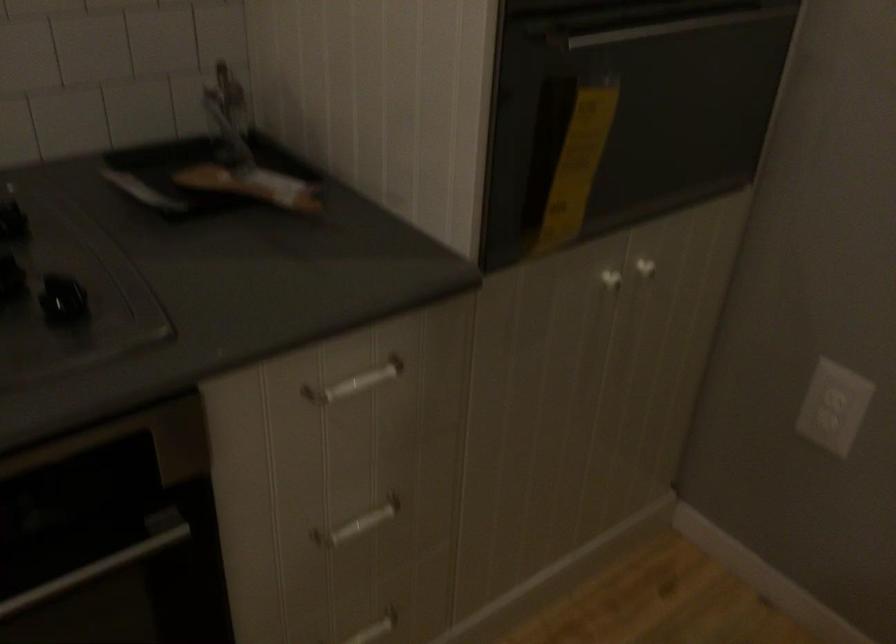
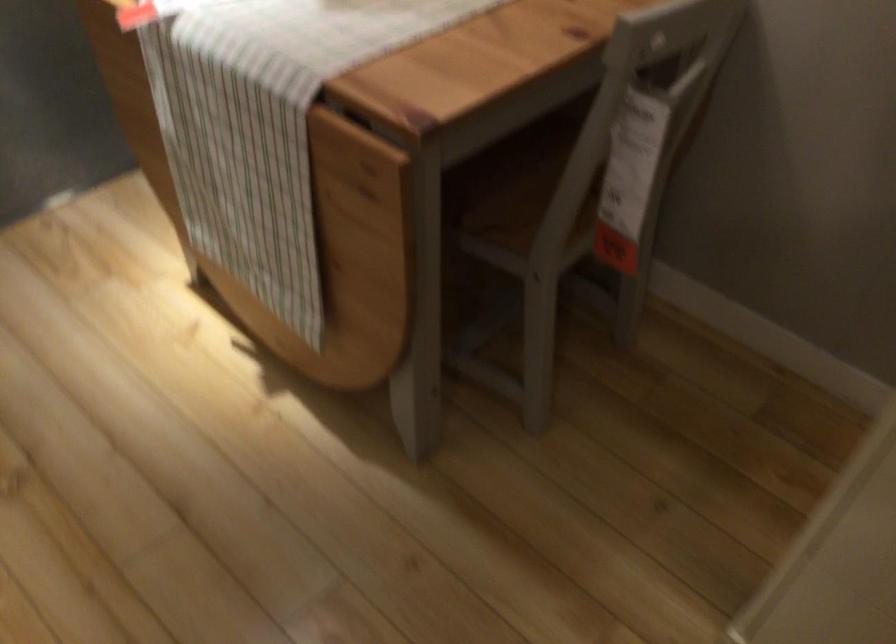
How did the camera likely rotate?

The camera rotated toward left-down.